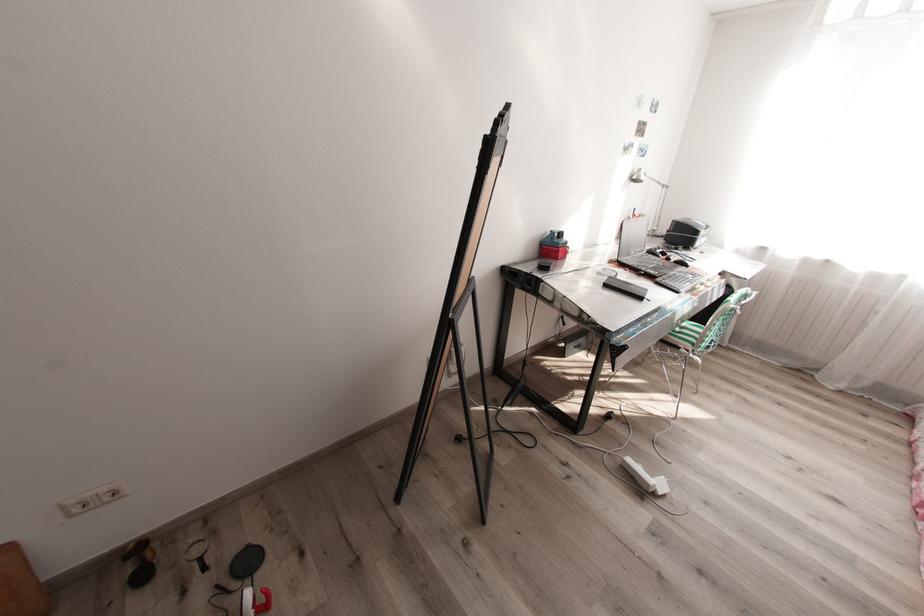
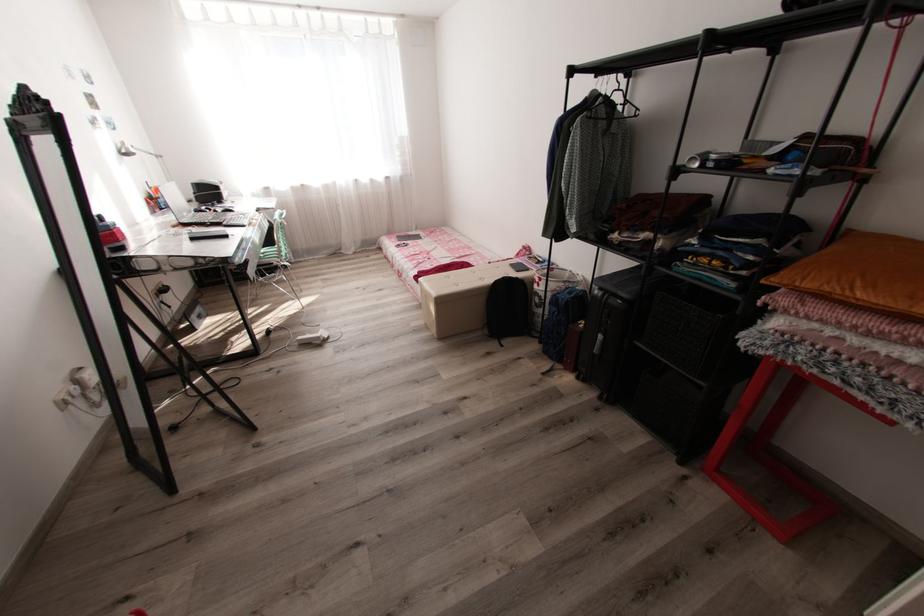
In the second image, find the point that corresponds to point (638, 177) in the first image.

(129, 151)